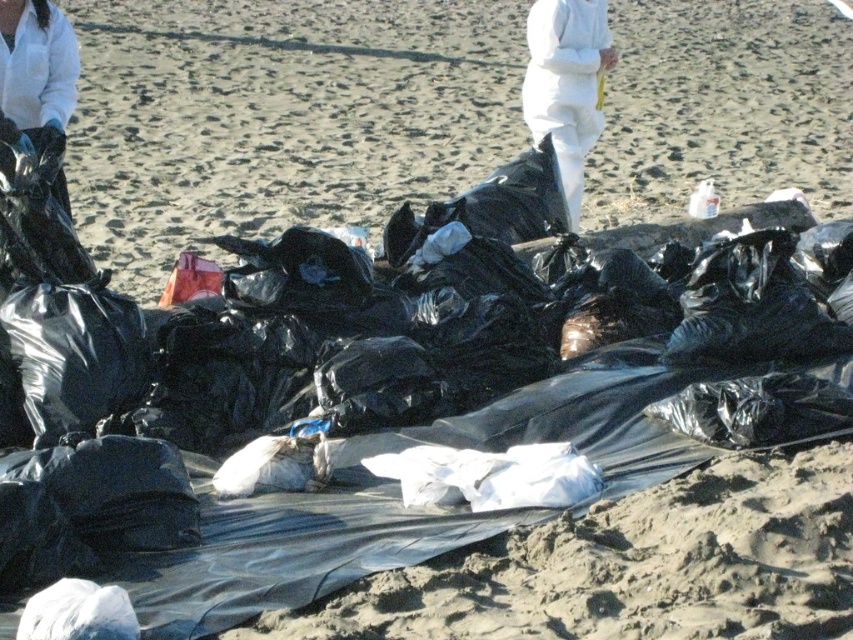
Is point (546, 20) closer to camera compared to point (59, 176)?

No.

In the scene shown: Is white fuzzy pants at center above matte black gloves at upper left?

Indeed, white fuzzy pants at center is positioned over matte black gloves at upper left.

Identify the location of white fuzzy pants at center. (566, 84).